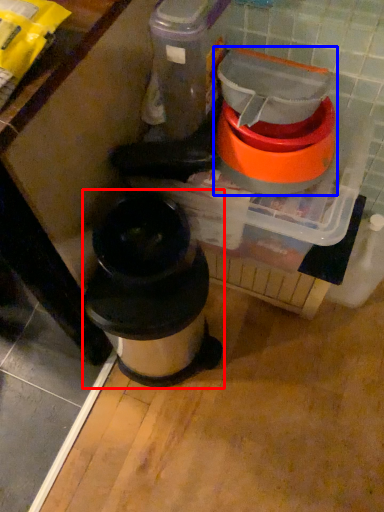
Question: Which object is further to the camera taking this photo, waste container (highlighted by a red box) or appliance (highlighted by a blue box)?

Choices:
 (A) waste container
 (B) appliance

Answer: (A)